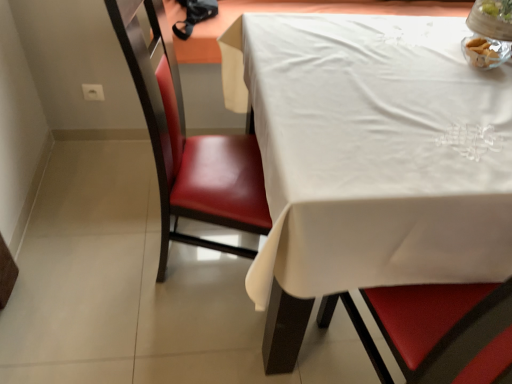
Image resolution: width=512 pixels, height=384 pixels. Identify the location of free space to the left of leather at left. (116, 258).